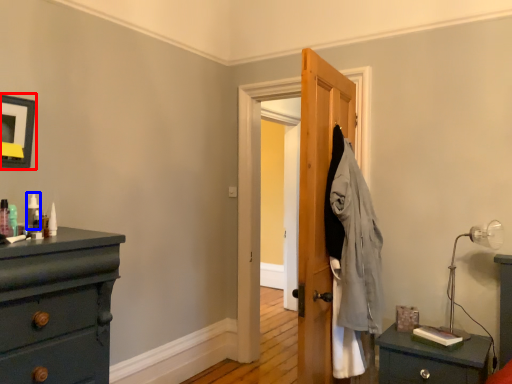
Question: Among these objects, which one is farthest to the camera, picture frame (highlighted by a red box) or toiletry (highlighted by a blue box)?

Choices:
 (A) picture frame
 (B) toiletry

Answer: (B)